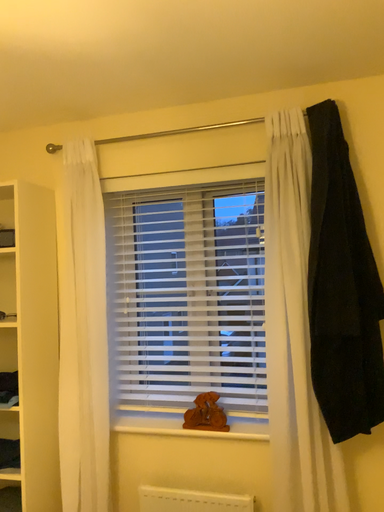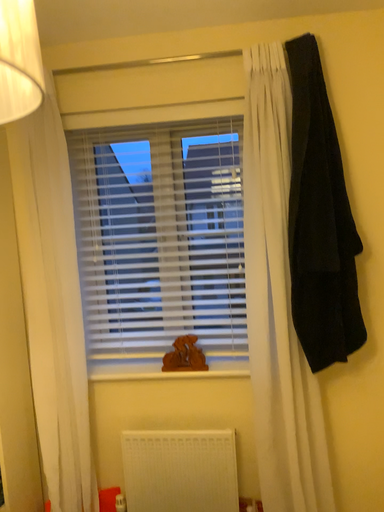
Question: Which way did the camera rotate in the video?

Choices:
 (A) rotated upward
 (B) rotated downward

Answer: (B)